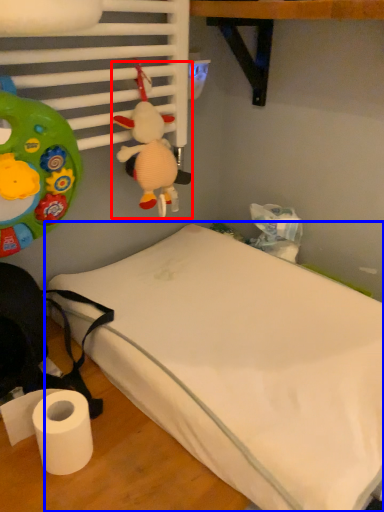
Question: Which object appears farthest to the camera in this image, toy (highlighted by a red box) or bed (highlighted by a blue box)?

Choices:
 (A) toy
 (B) bed

Answer: (A)